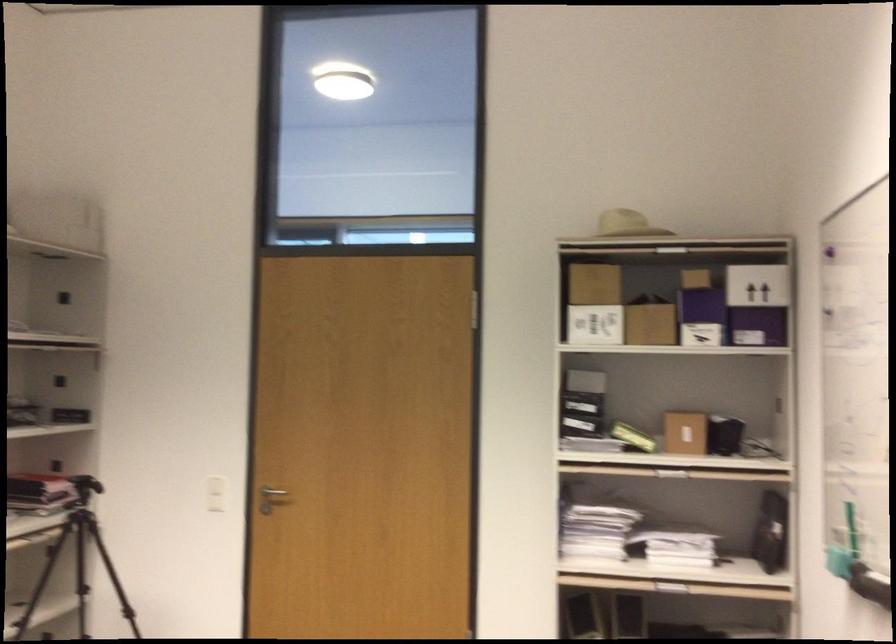
Describe the element at coordinates (216, 494) in the screenshot. The height and width of the screenshot is (644, 896). I see `the white light switch` at that location.